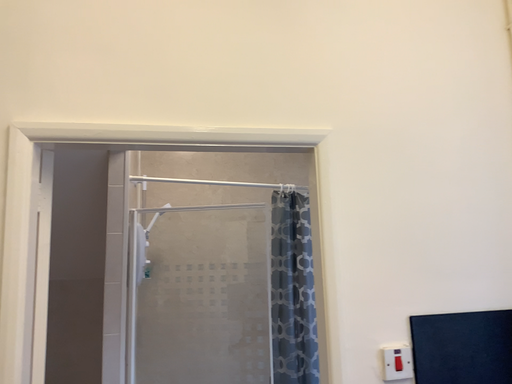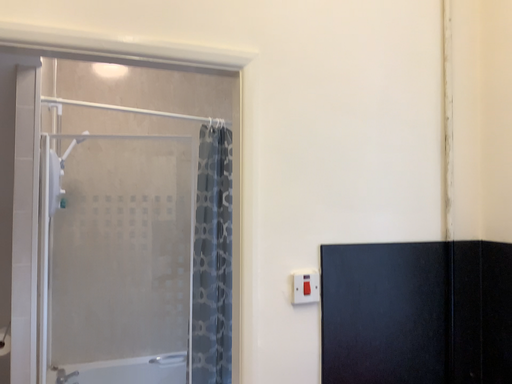
Question: How did the camera likely rotate when shooting the video?

Choices:
 (A) rotated downward
 (B) rotated upward

Answer: (A)